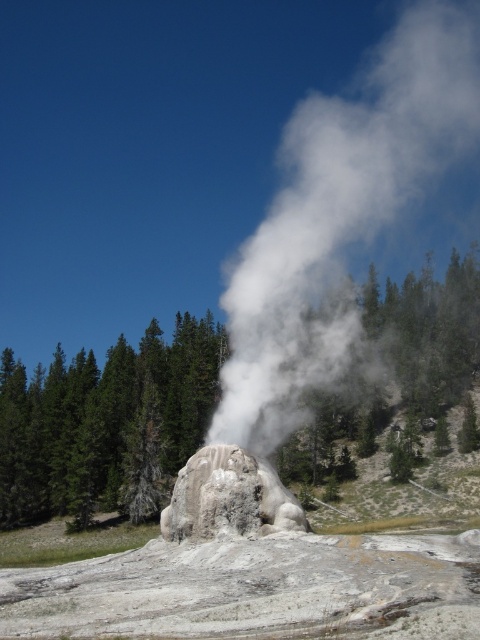
You are a photographer planning to capture the geyser and its steam. You want to ensure that the white vapor at center is wider than the gray stone geyser at center in your shot. Based on the scene description, will this be achievable?

Yes, the white vapor at center is wider than the gray stone geyser at center, so capturing this in the photo will be achievable.

You are a bird flying over the scene and want to land on the green textured tree at center. However, you notice the gray stone geyser at center below it. Can you safely land on the tree without getting hit by the geyser?

The green textured tree at center is positioned over gray stone geyser at center, so yes, you can safely land on the green textured tree at center as it is above the geyser and not in direct contact with it.

You are a photographer trying to capture the geyser and its steam. Based on the scene description, which object should you focus on first if you want to ensure the gray stone geyser at center is visible beneath the white vapor at center?

The white vapor at center is above the gray stone geyser at center, so you should focus on the gray stone geyser at center first to ensure it is visible beneath the white vapor at center.